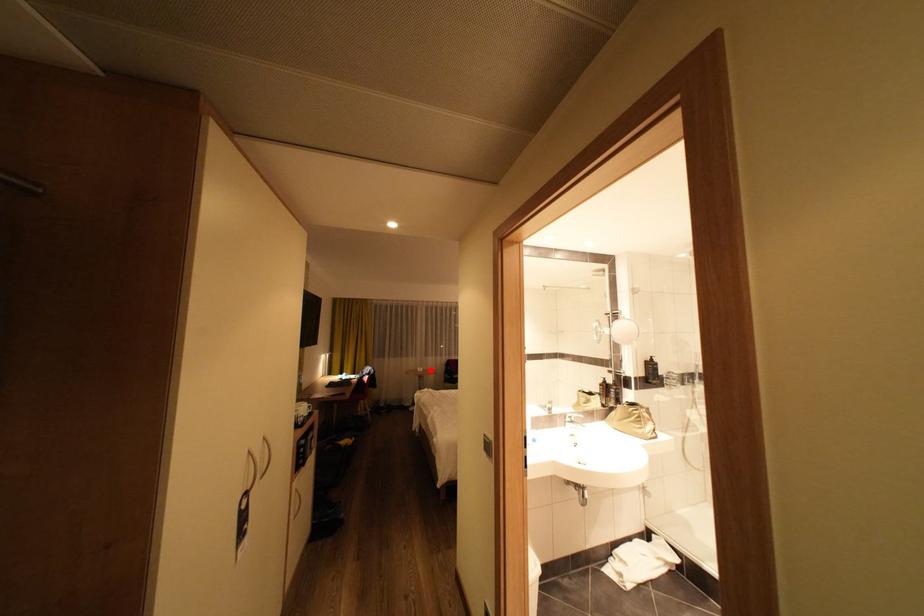
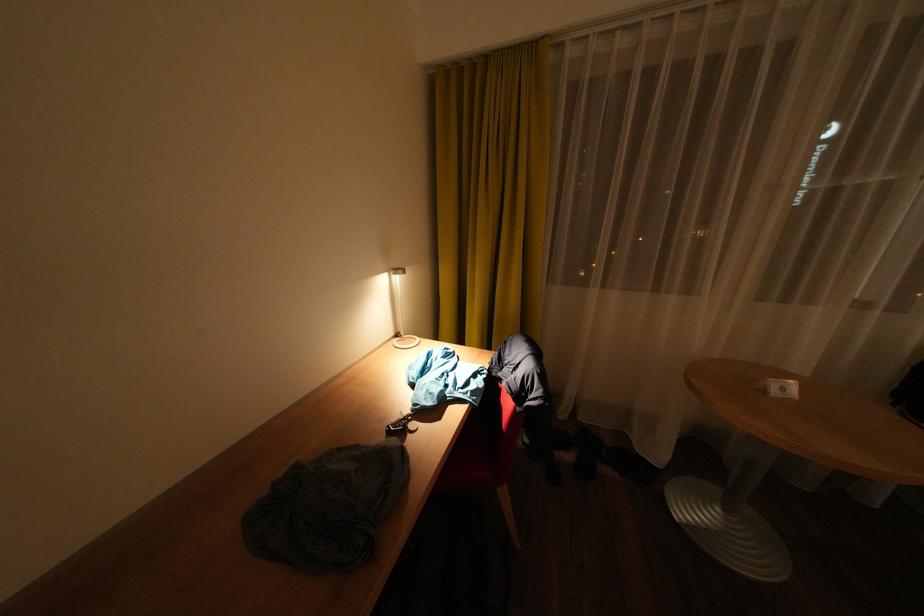
In the second image, find the point that corresponds to the highlighted location in the first image.

(794, 390)